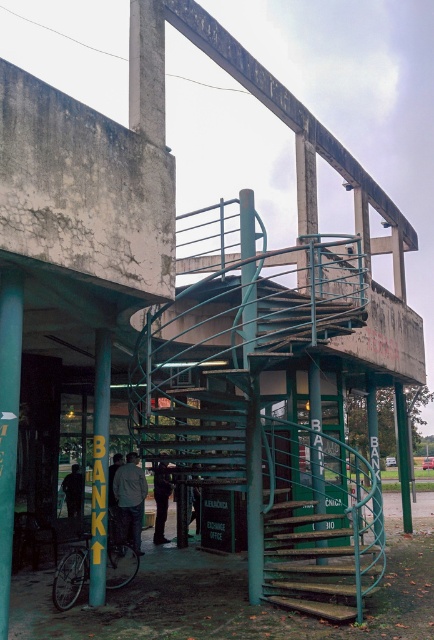
Question: Considering the real-world distances, which object is closest to the dark gray pants at center?

Choices:
 (A) dark gray jacket at lower left
 (B) yellow painted metal pole at lower left
 (C) dark gray jacket at center

Answer: (A)

Question: Is dark gray jacket at center to the right of dark gray jacket at lower left from the viewer's perspective?

Choices:
 (A) yes
 (B) no

Answer: (A)

Question: Is yellow painted metal pole at lower left to the right of dark gray pants at center from the viewer's perspective?

Choices:
 (A) no
 (B) yes

Answer: (A)

Question: Does yellow painted metal pole at lower left have a smaller size compared to dark gray jacket at center?

Choices:
 (A) no
 (B) yes

Answer: (B)

Question: Which of these objects is positioned closest to the wooden stairs at center?

Choices:
 (A) yellow painted metal pole at lower left
 (B) dark gray jacket at center
 (C) dark gray jacket at lower left

Answer: (A)

Question: Which point is farther from the camera taking this photo?

Choices:
 (A) (75, 484)
 (B) (269, 548)
 (C) (128, 540)
 (D) (164, 488)

Answer: (A)